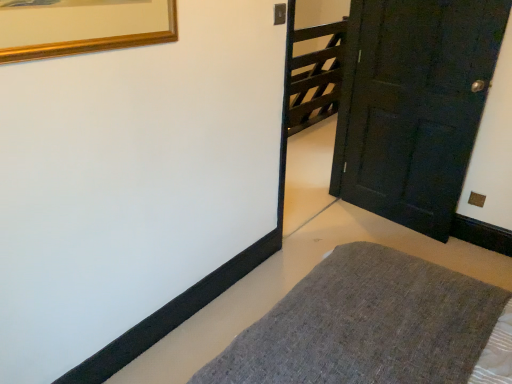
Locate an element on the screen. The height and width of the screenshot is (384, 512). free space in front of matte black door at right is located at coordinates (408, 246).